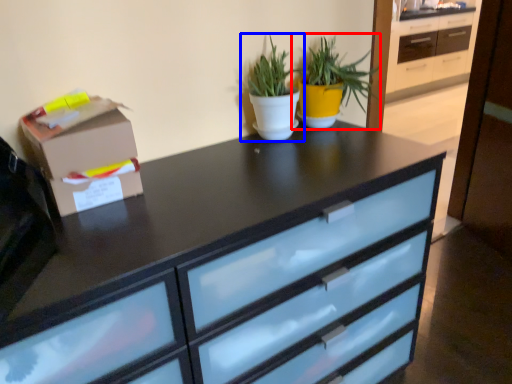
Question: Which object is closer to the camera taking this photo, houseplant (highlighted by a red box) or houseplant (highlighted by a blue box)?

Choices:
 (A) houseplant
 (B) houseplant

Answer: (B)